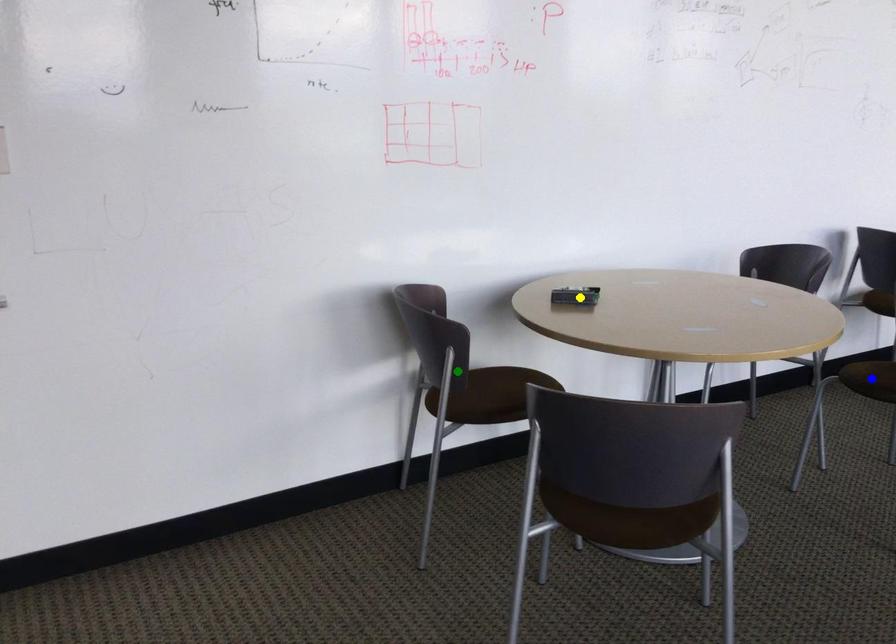
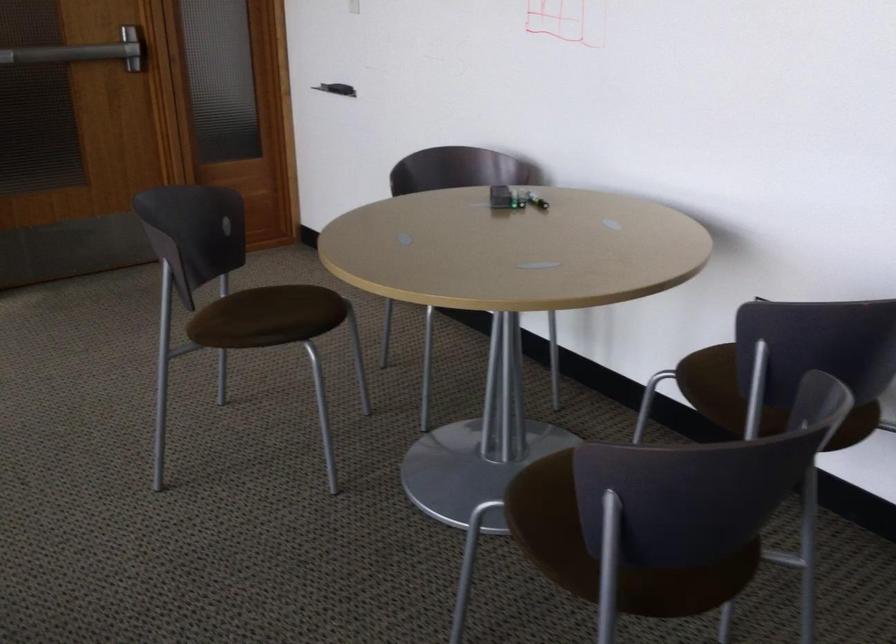
I am providing you with two images of the same scene from different viewpoints. Three points are marked in image1. Which point corresponds to a part or object that is occluded in image2?In image1, three points are marked. Which of them correspond to a part or object that is occluded in image2?Among the three points shown in image1, which one corresponds to a part or object that is no longer visible due to occlusion in image2?

blue point, green point